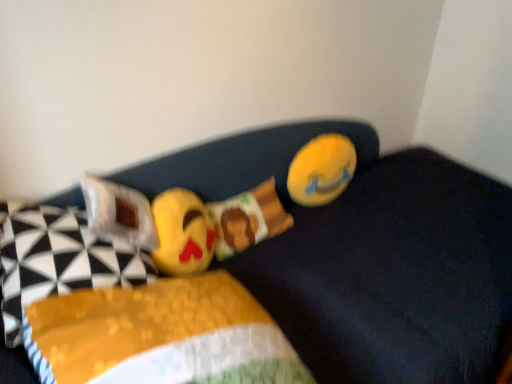
Image resolution: width=512 pixels, height=384 pixels. Identify the location of empty space that is ontop of yellow fabric pillow at left, marked as the 1th pillow in a left-to-right arrangement. (52, 221).